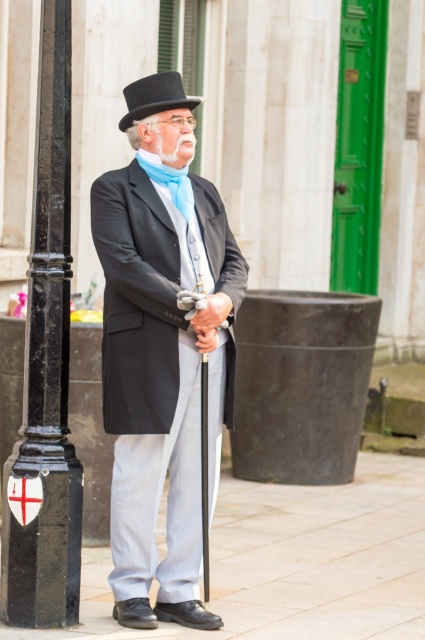
Can you confirm if matte black coat at center is bigger than light gray stone pavement at lower center?

Actually, matte black coat at center might be smaller than light gray stone pavement at lower center.

Which is in front, point (113, 582) or point (367, 589)?

Point (113, 582) is more forward.

Where is `matte black coat at center`? The height and width of the screenshot is (640, 425). matte black coat at center is located at coordinates (161, 348).

The height and width of the screenshot is (640, 425). What are the coordinates of `matte black coat at center` in the screenshot? It's located at click(161, 348).

Does matte black coat at center have a greater width compared to black polished metal pole at left?

Correct, the width of matte black coat at center exceeds that of black polished metal pole at left.

Is point (184, 182) closer to camera compared to point (28, 324)?

No.

Find the location of `matte black coat at center`. matte black coat at center is located at coordinates (161, 348).

Is point (96, 576) positioned in front of point (132, 93)?

No, (96, 576) is further to viewer.

Can you confirm if light gray stone pavement at lower center is taller than black felt top hat at upper center?

Indeed, light gray stone pavement at lower center has a greater height compared to black felt top hat at upper center.

Between point (257, 550) and point (184, 104), which one is positioned in front?

Point (184, 104) is in front.

Locate an element on the screen. Image resolution: width=425 pixels, height=640 pixels. light gray stone pavement at lower center is located at coordinates (294, 563).